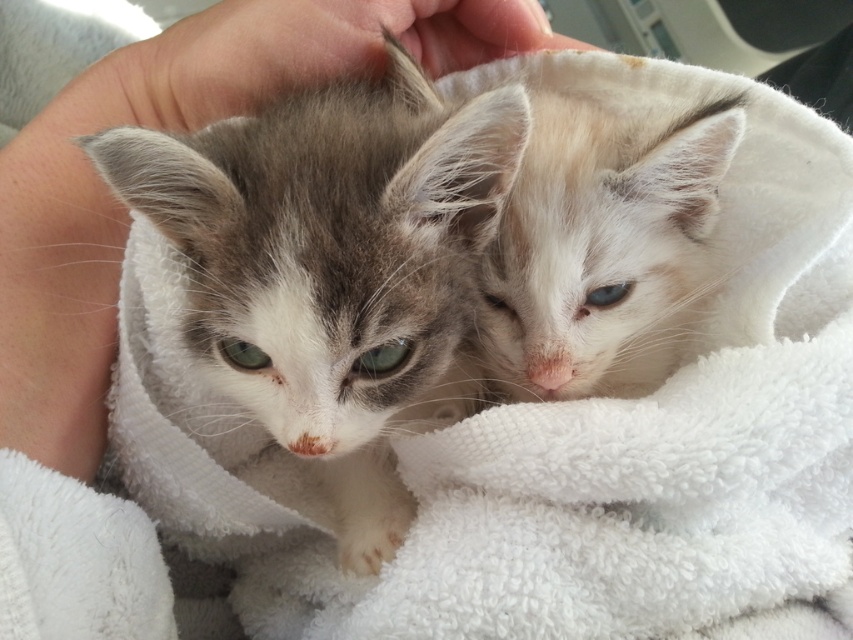
Which is more to the right, gray fluffy kitten at center or soft white fur kitten at center?

soft white fur kitten at center

In the scene shown: Is gray fluffy kitten at center positioned behind soft white fur kitten at center?

No, gray fluffy kitten at center is in front of soft white fur kitten at center.

This screenshot has height=640, width=853. What do you see at coordinates (334, 266) in the screenshot? I see `gray fluffy kitten at center` at bounding box center [334, 266].

This screenshot has width=853, height=640. What are the coordinates of `gray fluffy kitten at center` in the screenshot? It's located at (334, 266).